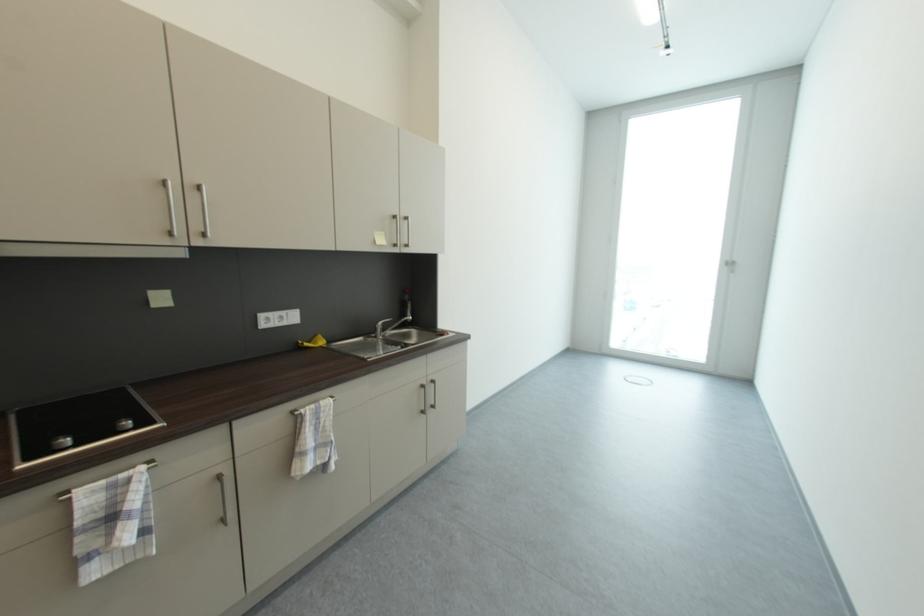
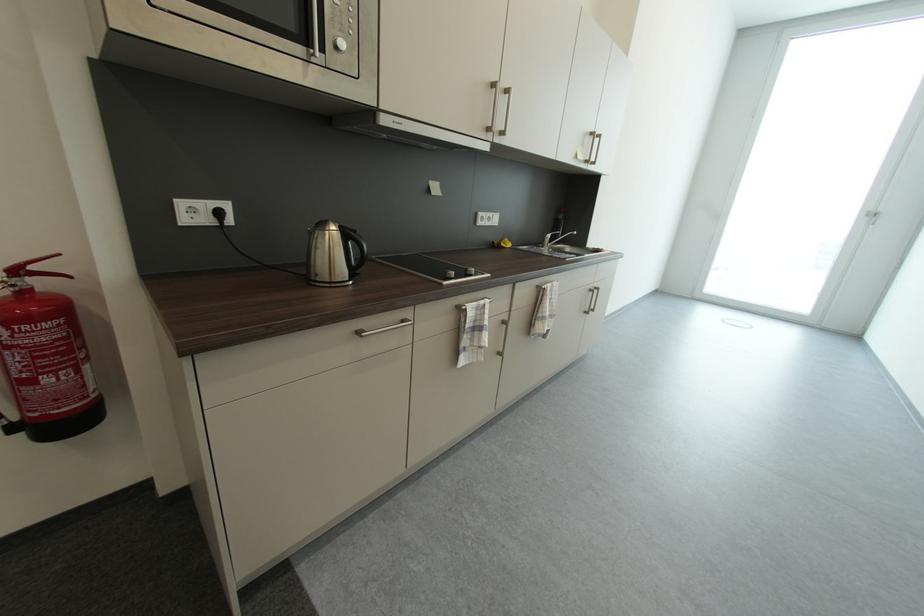
The images are taken continuously from a first-person perspective. In which direction are you moving?

The cameraman walked toward left, backward.